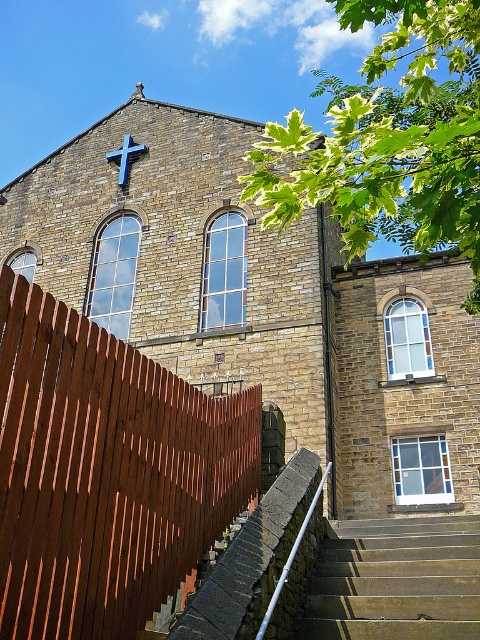
Looking at this image, is brown wooden fence at left bigger than blue painted wood cross at upper center?

Yes, brown wooden fence at left is bigger than blue painted wood cross at upper center.

Locate an element on the screen. The width and height of the screenshot is (480, 640). brown wooden fence at left is located at coordinates (106, 472).

Can you confirm if brown wooden fence at left is positioned below concrete stairs at center?

No, brown wooden fence at left is not below concrete stairs at center.

Which is more to the right, brown wooden fence at left or concrete stairs at center?

Positioned to the right is concrete stairs at center.

What do you see at coordinates (106, 472) in the screenshot? I see `brown wooden fence at left` at bounding box center [106, 472].

The height and width of the screenshot is (640, 480). I want to click on brown wooden fence at left, so click(x=106, y=472).

Between concrete stairs at center and blue painted wood cross at upper center, which one appears on the left side from the viewer's perspective?

Positioned to the left is blue painted wood cross at upper center.

Is point (326, 632) farther from camera compared to point (122, 147)?

No, it is in front of (122, 147).

What are the coordinates of `concrete stairs at center` in the screenshot? It's located at coord(396,580).